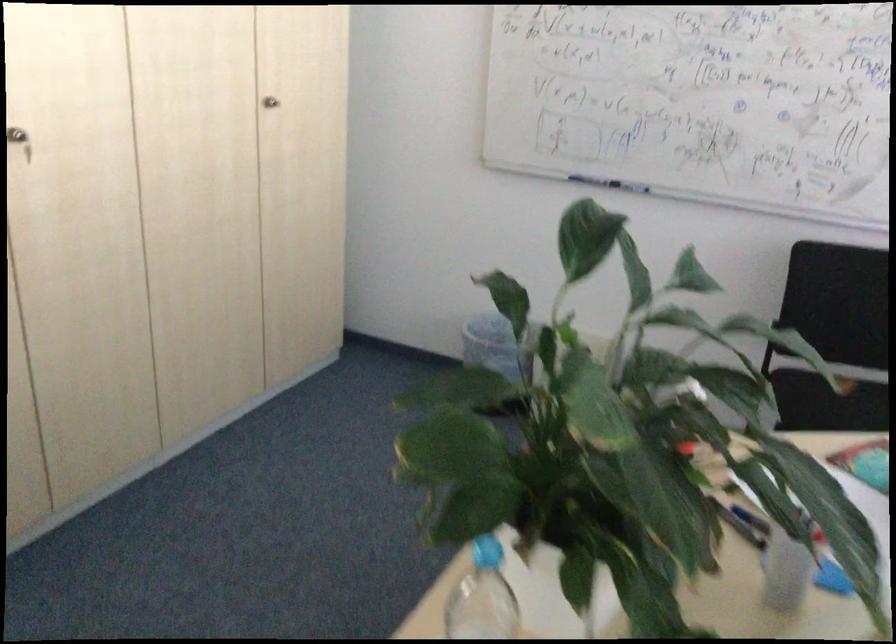
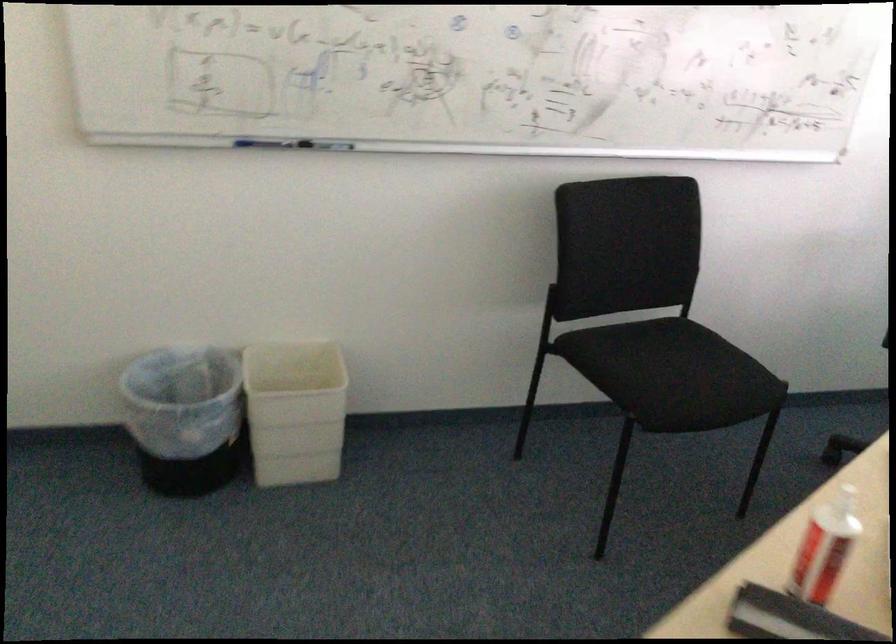
Question: How did the camera likely rotate?

Choices:
 (A) Left
 (B) Right
 (C) Up
 (D) Down

Answer: (B)